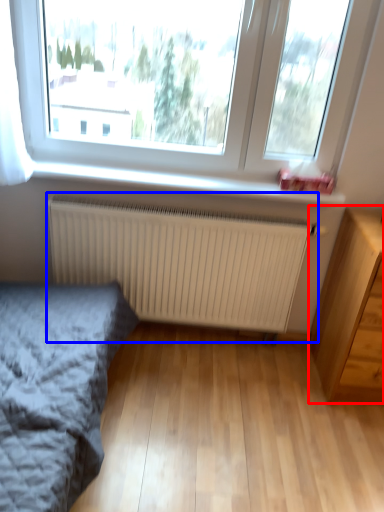
Question: Among these objects, which one is farthest to the camera, chest of drawers (highlighted by a red box) or radiator (highlighted by a blue box)?

Choices:
 (A) chest of drawers
 (B) radiator

Answer: (B)